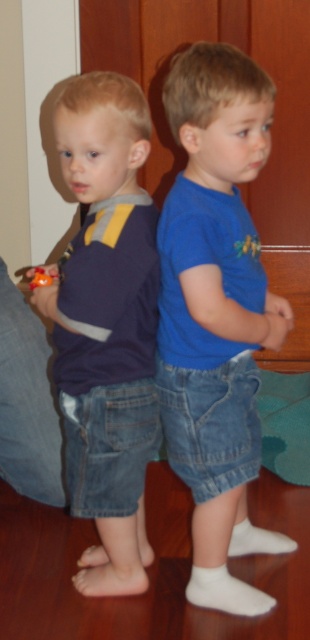
You are a delivery robot trying to navigate to a specific point in the room. You are currently at point (251, 120). There is an obstacle at point (41, 269). Can you safely move forward without hitting the obstacle?

Point (251, 120) is in front of point (41, 269), so moving forward from point (251, 120) would lead directly towards the obstacle at point (41, 269). Therefore, you cannot safely move forward without hitting the obstacle.

You are a toy collector who wants to place the orange matte toy at lower left closer to the matte blue shirt at left. If your hand can reach up to 14 inches, can you grab the toy and move it to the shirt without bending down?

The distance between the matte blue shirt at left and the orange matte toy at lower left is 12.20 inches. Since your hand can reach up to 14 inches, you can easily grab the toy and move it to the shirt without needing to bend down.